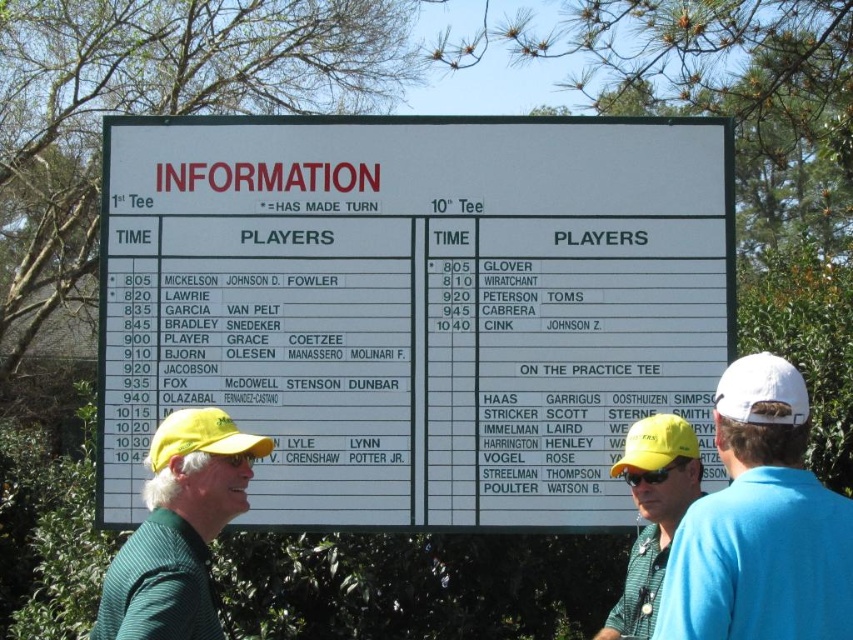
Question: Does white plastic sign at center have a lesser width compared to yellow fabric cap at center?

Choices:
 (A) yes
 (B) no

Answer: (B)

Question: Does green striped shirt at center appear under yellow matte baseball cap at center?

Choices:
 (A) no
 (B) yes

Answer: (B)

Question: Considering the real-world distances, which object is closest to the white plastic sign at center?

Choices:
 (A) yellow fabric cap at left
 (B) white matte baseball cap at center-right

Answer: (A)

Question: Which point is closer to the camera?

Choices:
 (A) (743, 518)
 (B) (595, 204)
 (C) (187, 422)

Answer: (A)

Question: Can you confirm if white matte baseball cap at center-right is thinner than yellow matte baseball cap at center?

Choices:
 (A) no
 (B) yes

Answer: (B)

Question: Which point is closer to the camera?

Choices:
 (A) yellow matte baseball cap at center
 (B) blue cotton shirt at right
 (C) white matte baseball cap at center-right
 (D) white plastic sign at center

Answer: (B)